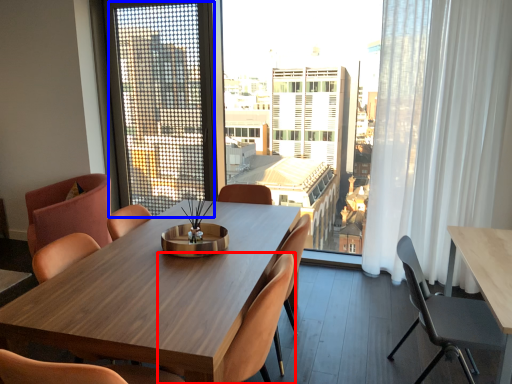
Question: Which of the following is the farthest to the observer, chair (highlighted by a red box) or screen door (highlighted by a blue box)?

Choices:
 (A) chair
 (B) screen door

Answer: (B)